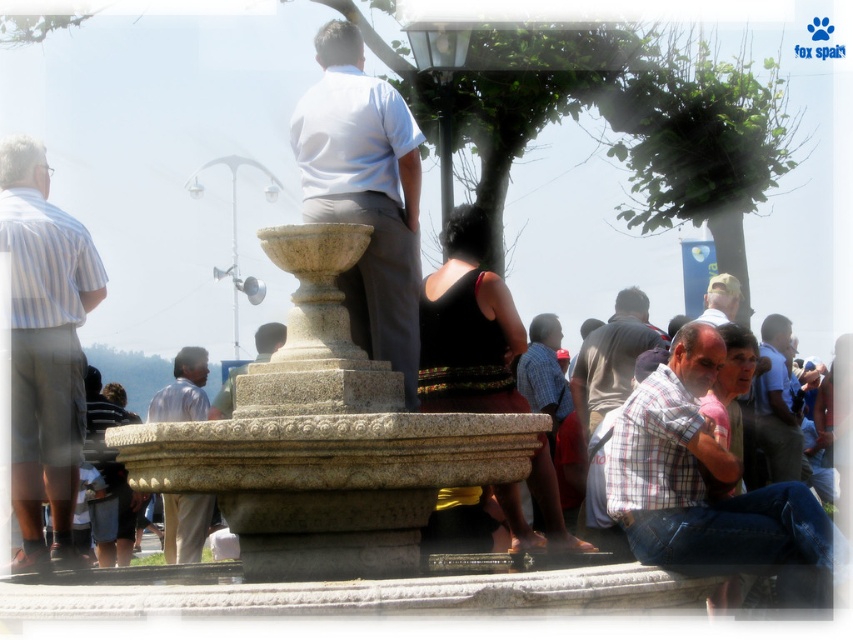
Can you confirm if striped cotton shirt at left is positioned below black fabric dress at center?

No, striped cotton shirt at left is not below black fabric dress at center.

Can you confirm if striped cotton shirt at left is bigger than black fabric dress at center?

No, striped cotton shirt at left is not bigger than black fabric dress at center.

Find the location of a particular element. This screenshot has width=853, height=640. striped cotton shirt at left is located at coordinates (44, 348).

Can you confirm if striped cotton shirt at left is bigger than matte yellow cap at center?

Correct, striped cotton shirt at left is larger in size than matte yellow cap at center.

Does striped cotton shirt at left appear on the right side of matte yellow cap at center?

Incorrect, striped cotton shirt at left is not on the right side of matte yellow cap at center.

Identify the location of striped cotton shirt at left. This screenshot has width=853, height=640. (44, 348).

Does plaid cotton shirt at lower right appear on the left side of black fabric dress at center?

Incorrect, plaid cotton shirt at lower right is not on the left side of black fabric dress at center.

Can you confirm if plaid cotton shirt at lower right is smaller than black fabric dress at center?

No, plaid cotton shirt at lower right is not smaller than black fabric dress at center.

This screenshot has width=853, height=640. What do you see at coordinates (708, 477) in the screenshot? I see `plaid cotton shirt at lower right` at bounding box center [708, 477].

Locate an element on the screen. plaid cotton shirt at lower right is located at coordinates (708, 477).